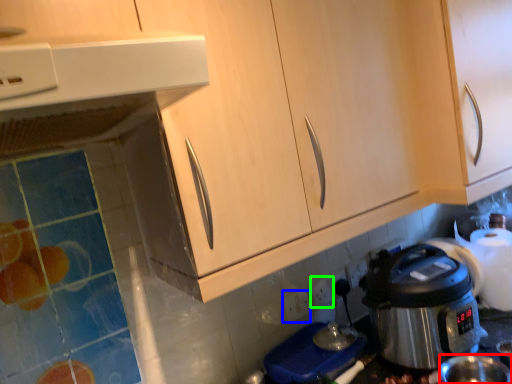
Question: Which object is the farthest from coffee cup (highlighted by a red box)? Choose among these: power outlet (highlighted by a blue box) or electric outlet (highlighted by a green box).

Choices:
 (A) power outlet
 (B) electric outlet

Answer: (A)